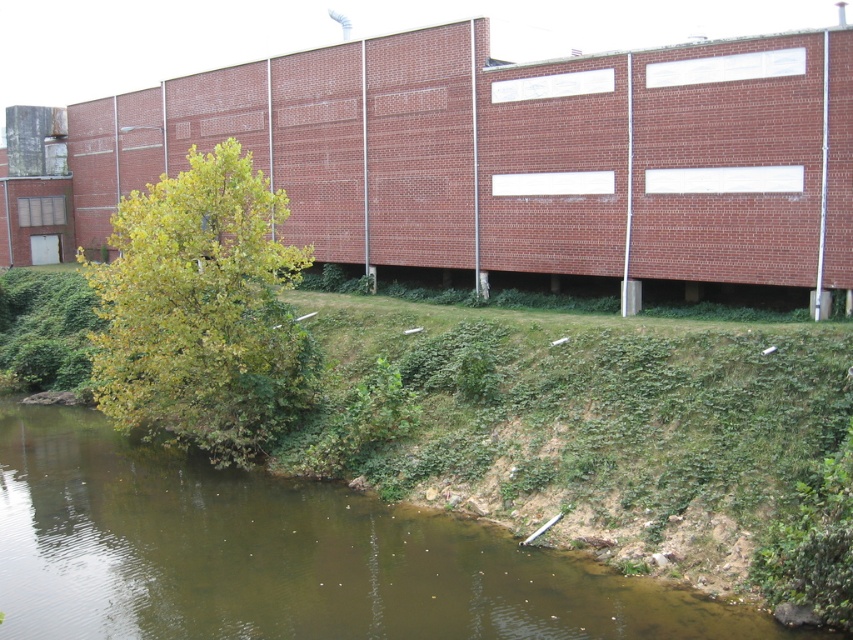
Can you confirm if green mossy river at lower left is positioned above green leafy tree at lower left?

No.

Is green mossy river at lower left further to camera compared to green leafy tree at lower left?

No.

Identify the location of green mossy river at lower left. The image size is (853, 640). (283, 556).

Identify the location of green mossy river at lower left. (283, 556).